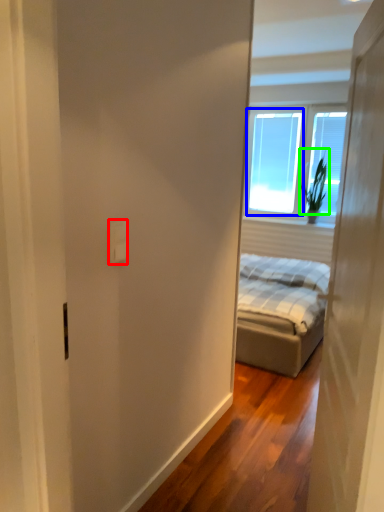
Question: Based on their relative distances, which object is farther from electric outlet (highlighted by a red box)? Choose from window screen (highlighted by a blue box) and plant (highlighted by a green box).

Choices:
 (A) window screen
 (B) plant

Answer: (A)